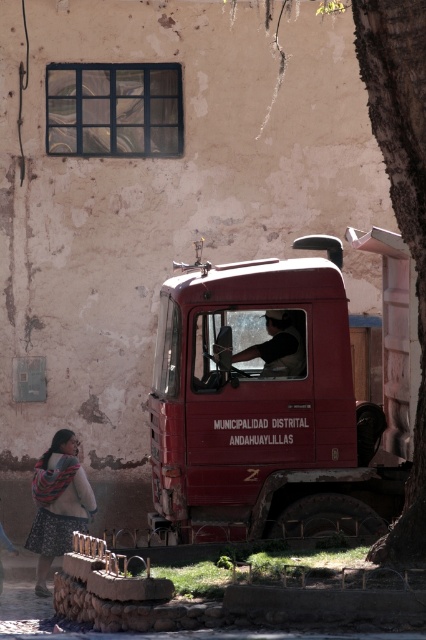
Is point (46, 486) farther from camera compared to point (287, 330)?

Yes, point (46, 486) is behind point (287, 330).

Between floral skirt at lower left and dark gray fabric shirt at center, which one is positioned higher?

Positioned higher is dark gray fabric shirt at center.

Which is behind, point (74, 477) or point (270, 369)?

Point (74, 477)

Image resolution: width=426 pixels, height=640 pixels. Identify the location of floral skirt at lower left. (57, 502).

Is matte red truck at center thinner than smooth bark tree trunk at right?

No, matte red truck at center is not thinner than smooth bark tree trunk at right.

Describe the element at coordinates (262, 404) in the screenshot. Image resolution: width=426 pixels, height=640 pixels. I see `matte red truck at center` at that location.

Is point (170, 289) closer to camera compared to point (374, 8)?

No, it is behind (374, 8).

At what (x,y) coordinates should I click in order to perform the action: click on matte red truck at center. Please return your answer as a coordinate pair (x, y). Looking at the image, I should click on click(262, 404).

Does matte red truck at center appear on the right side of dark gray fabric shirt at center?

Incorrect, matte red truck at center is not on the right side of dark gray fabric shirt at center.

Is matte red truck at center to the left of dark gray fabric shirt at center from the viewer's perspective?

Correct, you'll find matte red truck at center to the left of dark gray fabric shirt at center.

Between point (247, 476) and point (302, 342), which one is positioned in front?

Positioned in front is point (247, 476).

I want to click on matte red truck at center, so click(x=262, y=404).